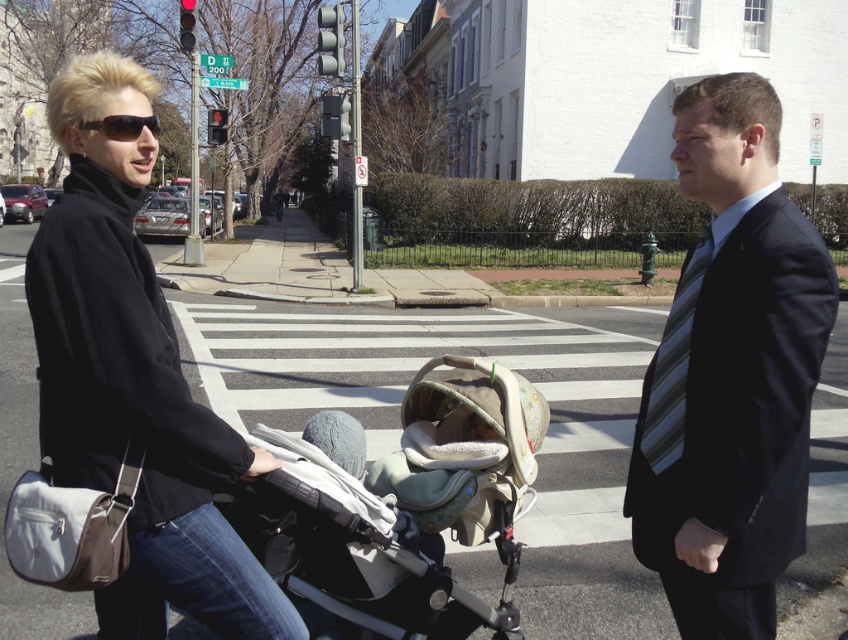
Question: Is beige fabric baby carriage at center positioned at the back of black plastic sunglasses at upper left?

Choices:
 (A) yes
 (B) no

Answer: (B)

Question: Which point is farther from the camera taking this photo?

Choices:
 (A) (665, 364)
 (B) (293, 541)
 (C) (157, 426)

Answer: (B)

Question: Is dark blue suit at center further to the viewer compared to black matte jacket at upper left?

Choices:
 (A) no
 (B) yes

Answer: (A)

Question: Which point is closer to the camera taking this photo?

Choices:
 (A) (665, 432)
 (B) (511, 486)
 (C) (657, 422)
 (D) (93, 128)

Answer: (D)

Question: Is dark blue suit at center smaller than striped fabric tie at right?

Choices:
 (A) yes
 (B) no

Answer: (B)

Question: Which object appears farthest from the camera in this image?

Choices:
 (A) dark blue suit at center
 (B) black matte jacket at upper left

Answer: (B)